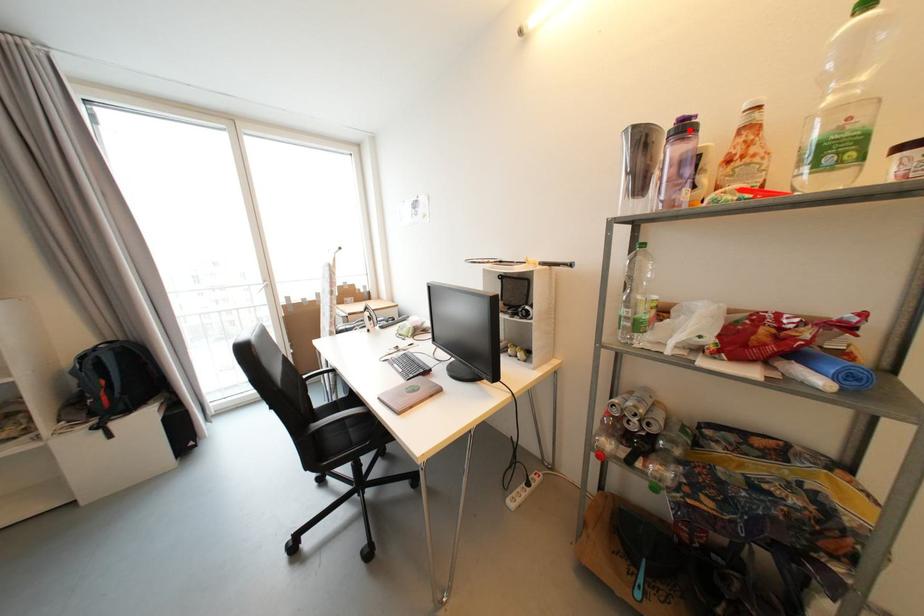
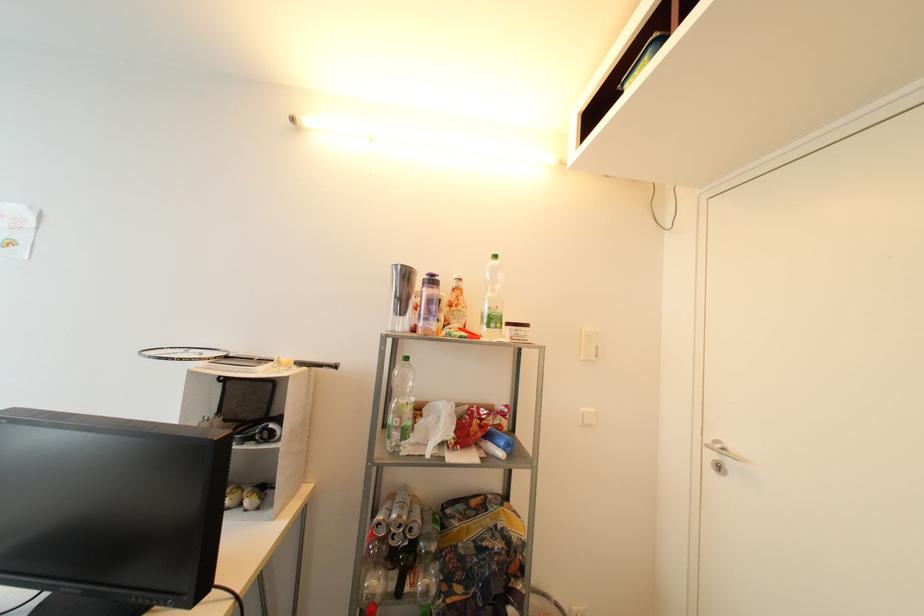
Locate, in the second image, the point that corresponds to the highlighted location in the first image.

(438, 283)